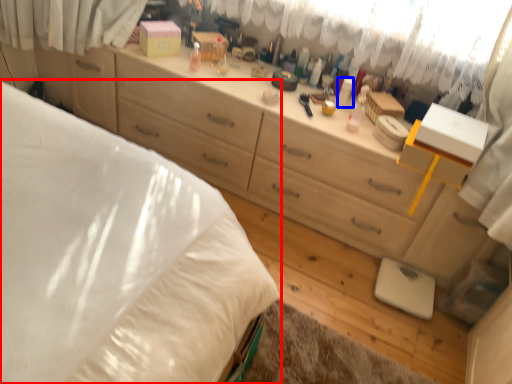
Question: Which object appears closest to the camera in this image, bed (highlighted by a red box) or toiletry (highlighted by a blue box)?

Choices:
 (A) bed
 (B) toiletry

Answer: (A)